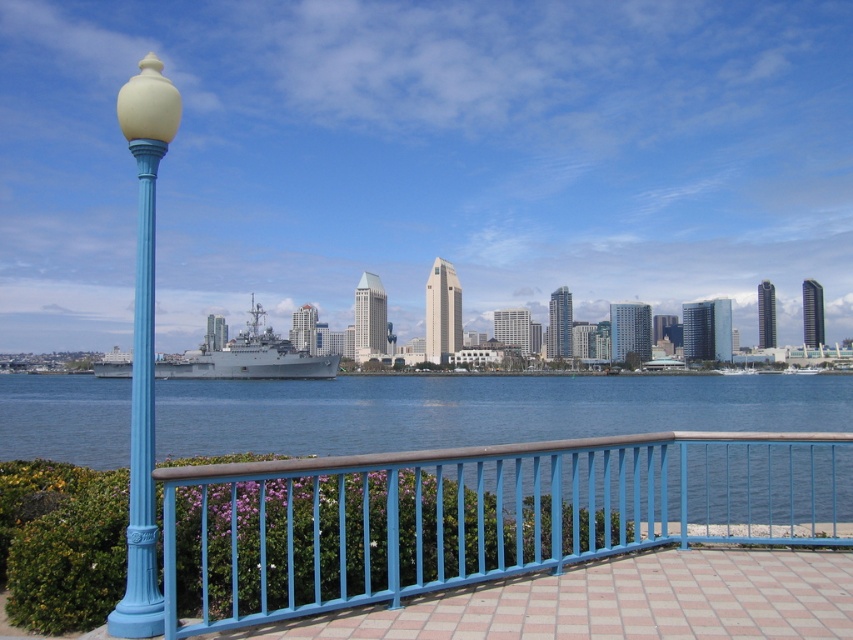
Does blue painted metal railing at center have a larger size compared to blue water at center?

Actually, blue painted metal railing at center might be smaller than blue water at center.

Who is more distant from viewer, (239, 477) or (18, 433)?

Positioned behind is point (18, 433).

Does point (183, 488) lie in front of point (9, 388)?

That is True.

What are the coordinates of `blue painted metal railing at center` in the screenshot? It's located at (479, 515).

Between blue water at center and gray metallic ship at center, which one has less height?

With less height is blue water at center.

Consider the image. Which is more to the right, blue water at center or gray metallic ship at center?

Positioned to the right is blue water at center.

Identify the location of blue water at center. This screenshot has width=853, height=640. (479, 410).

Where is `blue water at center`? blue water at center is located at coordinates (479, 410).

Between blue painted metal railing at center and matte blue pole at left, which one is positioned higher?

matte blue pole at left is above.

Who is lower down, blue painted metal railing at center or matte blue pole at left?

Positioned lower is blue painted metal railing at center.

Is point (196, 552) behind point (149, 364)?

Yes, point (196, 552) is farther from viewer.

Where is `blue painted metal railing at center`? blue painted metal railing at center is located at coordinates (479, 515).